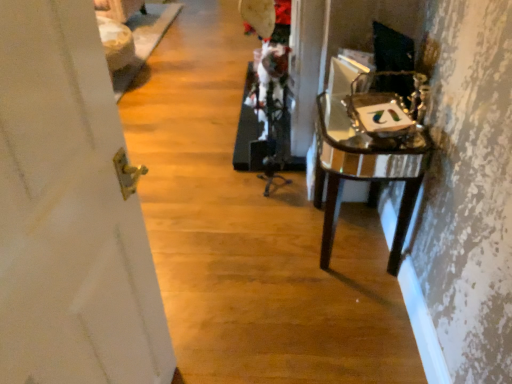
At what (x,y) coordinates should I click in order to perform the action: click on free point to the left of glossy glass table at right. Please return your answer as a coordinate pair (x, y). The width and height of the screenshot is (512, 384). Looking at the image, I should click on (266, 248).